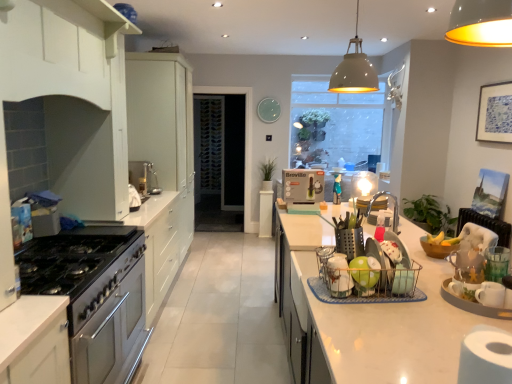
Question: From the image's perspective, is green matte dish rack at center, which is counted as the first appliance, starting from the left, positioned above or below green matte plant at center, the 2th plant viewed from the front?

Choices:
 (A) above
 (B) below

Answer: (B)

Question: From a real-world perspective, is green matte dish rack at center, which is counted as the first appliance, starting from the left, positioned above or below green matte plant at center, arranged as the 2th plant when ordered from the bottom?

Choices:
 (A) below
 (B) above

Answer: (B)

Question: Which is nearer to the white wood shelf at upper center, which ranks as the first cabinetry in front-to-back order?

Choices:
 (A) green matte dish rack at center, arranged as the first appliance when viewed from the front
 (B) stainless steel oven at left
 (C) transparent glass door at center
 (D) metallic silver utensil holder at right, the third appliance viewed from the back
 (E) matte white light bulb at center, the fourth appliance viewed from the left

Answer: (B)

Question: Considering the real-world distances, which object is farthest from the white matte cabinet at left, which is the 2th cabinetry in back-to-front order?

Choices:
 (A) green matte dish rack at center, arranged as the first appliance when viewed from the front
 (B) matte white light bulb at center, marked as the 1th appliance in a right-to-left arrangement
 (C) translucent glass window at center
 (D) blue paper picture frame at upper right
 (E) green leafy plant at right, placed as the second plant when sorted from left to right

Answer: (C)